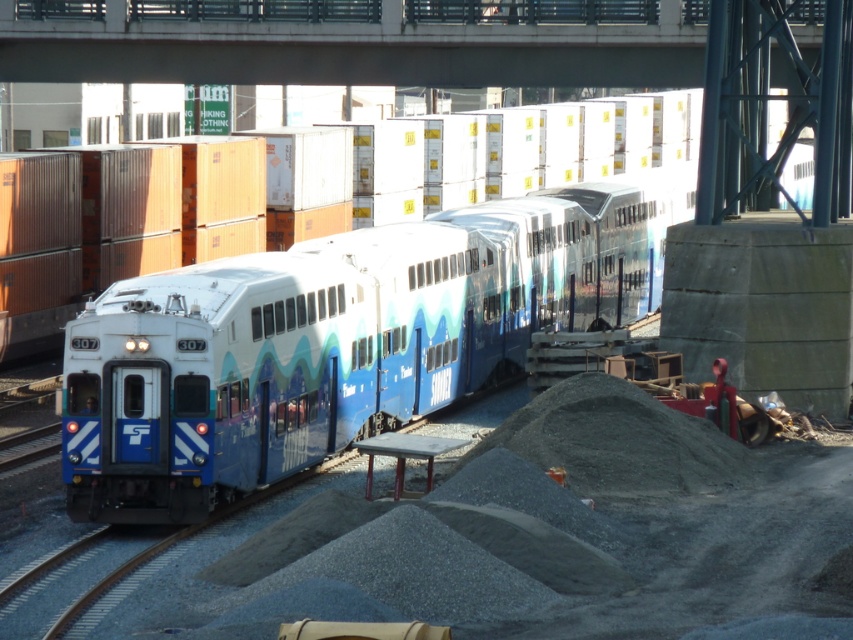
You are a maintenance worker at the train station. You need to inspect the blue glossy train at center and the concrete at upper center. Which object is located above the other?

The concrete at upper center is above the blue glossy train at center.

You are a photographer planning to capture the blue glossy train at center and the concrete at upper center in a single wide shot. Given their relative sizes, which object should you position closer to the camera to ensure both fit within the frame?

Since the blue glossy train at center is narrower than the concrete at upper center, you should position the blue glossy train at center closer to the camera to ensure both fit within the frame.